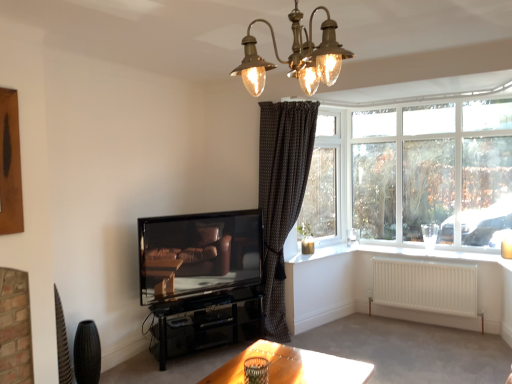
Question: Considering the relative sizes of brass textured chandelier at upper center and matte black television at center in the image provided, is brass textured chandelier at upper center wider than matte black television at center?

Choices:
 (A) no
 (B) yes

Answer: (B)

Question: Would you say brass textured chandelier at upper center contains matte black television at center?

Choices:
 (A) no
 (B) yes

Answer: (A)

Question: Can you confirm if brass textured chandelier at upper center is positioned to the right of matte black television at center?

Choices:
 (A) no
 (B) yes

Answer: (B)

Question: Can you confirm if brass textured chandelier at upper center is bigger than matte black television at center?

Choices:
 (A) yes
 (B) no

Answer: (B)

Question: Is brass textured chandelier at upper center to the left of matte black television at center from the viewer's perspective?

Choices:
 (A) no
 (B) yes

Answer: (A)

Question: In terms of height, does matte black television at center look taller or shorter compared to white glass window at upper right?

Choices:
 (A) tall
 (B) short

Answer: (B)

Question: Is matte black television at center to the left or to the right of white glass window at upper right in the image?

Choices:
 (A) right
 (B) left

Answer: (B)

Question: From a real-world perspective, relative to white glass window at upper right, is matte black television at center vertically above or below?

Choices:
 (A) below
 (B) above

Answer: (A)

Question: From the image's perspective, relative to white glass window at upper right, is matte black television at center above or below?

Choices:
 (A) below
 (B) above

Answer: (A)

Question: In terms of size, does white matte radiator at lower right appear bigger or smaller than black textured curtain at upper right?

Choices:
 (A) small
 (B) big

Answer: (A)

Question: Is white matte radiator at lower right wider or thinner than black textured curtain at upper right?

Choices:
 (A) thin
 (B) wide

Answer: (B)

Question: Is white matte radiator at lower right spatially inside black textured curtain at upper right, or outside of it?

Choices:
 (A) inside
 (B) outside

Answer: (B)

Question: Is white matte radiator at lower right in front of or behind black textured curtain at upper right in the image?

Choices:
 (A) front
 (B) behind

Answer: (A)

Question: Is black textured curtain at upper right spatially inside white painted wood at lower right, or outside of it?

Choices:
 (A) outside
 (B) inside

Answer: (A)

Question: Considering the relative positions of black textured curtain at upper right and white painted wood at lower right in the image provided, is black textured curtain at upper right to the left or to the right of white painted wood at lower right?

Choices:
 (A) right
 (B) left

Answer: (B)